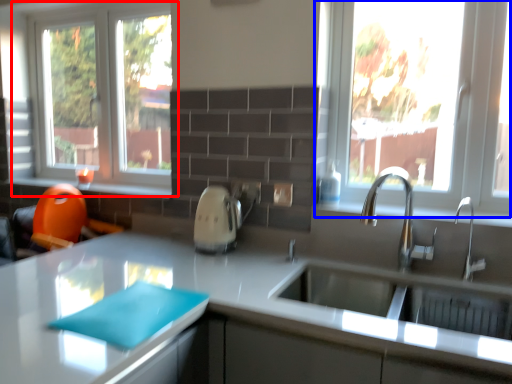
Question: Which of the following is the closest to the observer, window (highlighted by a red box) or window (highlighted by a blue box)?

Choices:
 (A) window
 (B) window

Answer: (B)